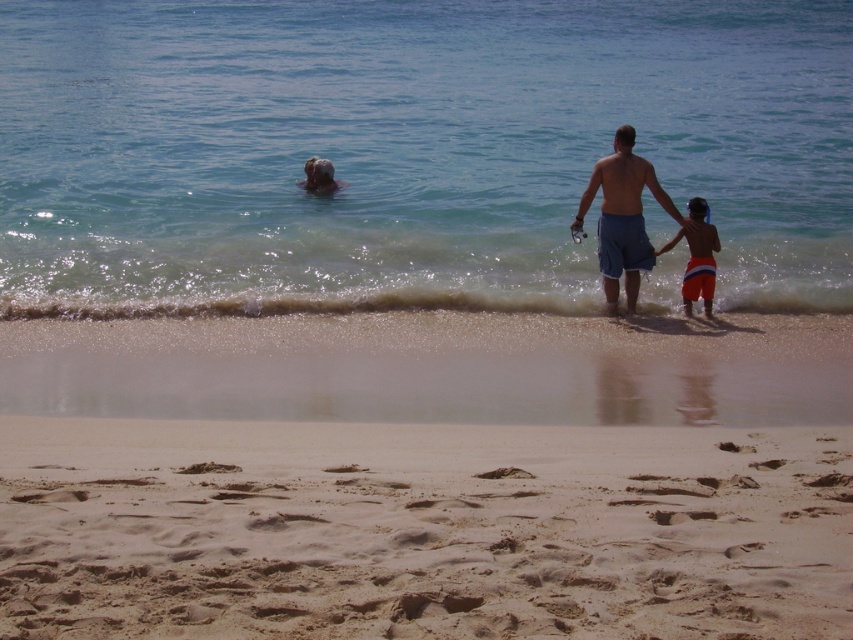
Is fine-grained sand at lower center smaller than orange striped shorts at right?

No.

Between fine-grained sand at lower center and orange striped shorts at right, which one appears on the left side from the viewer's perspective?

Positioned to the left is fine-grained sand at lower center.

I want to click on fine-grained sand at lower center, so pyautogui.click(x=421, y=531).

Based on the photo, can you confirm if clear blue water at upper center is taller than fine-grained sand at lower center?

Yes, clear blue water at upper center is taller than fine-grained sand at lower center.

The width and height of the screenshot is (853, 640). What do you see at coordinates (408, 150) in the screenshot?
I see `clear blue water at upper center` at bounding box center [408, 150].

Is point (599, 112) positioned behind point (463, 524)?

Yes, point (599, 112) is farther from viewer.

Identify the location of clear blue water at upper center. (408, 150).

Does clear blue water at upper center have a lesser width compared to blue denim shorts at center?

No, clear blue water at upper center is not thinner than blue denim shorts at center.

Who is positioned more to the right, clear blue water at upper center or blue denim shorts at center?

blue denim shorts at center is more to the right.

Is point (244, 29) more distant than point (625, 221)?

Yes, it is behind point (625, 221).

Find the location of a particular element. The width and height of the screenshot is (853, 640). clear blue water at upper center is located at coordinates (408, 150).